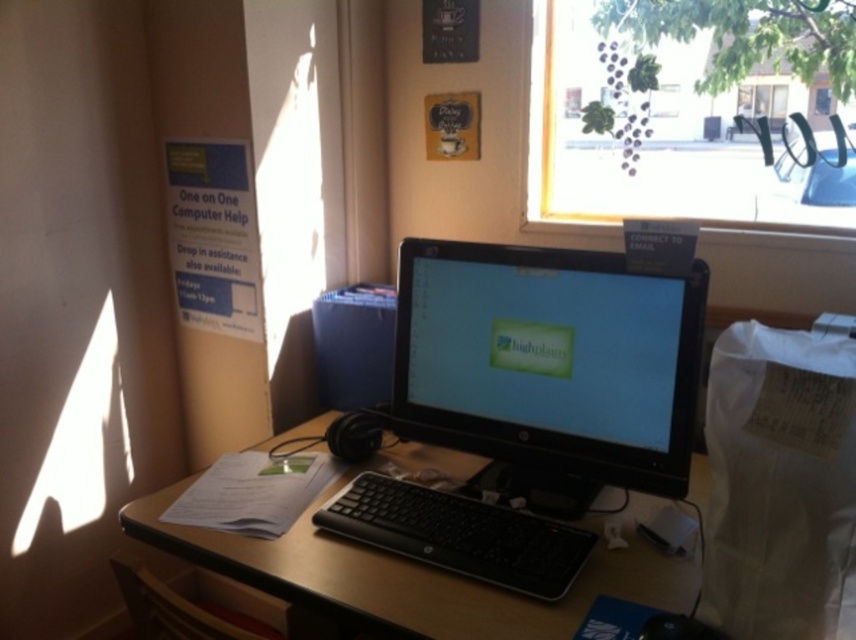
Question: Is black plastic computer desk at center to the left of black plastic keyboard at center from the viewer's perspective?

Choices:
 (A) yes
 (B) no

Answer: (A)

Question: Does black plastic monitor at center have a lesser width compared to satin black monitor at center?

Choices:
 (A) no
 (B) yes

Answer: (A)

Question: Which point is farther to the camera?

Choices:
 (A) black plastic monitor at center
 (B) black plastic keyboard at center
 (C) satin black monitor at center
 (D) transparent glass window at upper right

Answer: (D)

Question: Estimate the real-world distances between objects in this image. Which object is farther from the black plastic computer desk at center?

Choices:
 (A) satin black monitor at center
 (B) transparent glass window at upper right

Answer: (B)

Question: Can you confirm if transparent glass window at upper right is positioned to the left of black plastic computer desk at center?

Choices:
 (A) no
 (B) yes

Answer: (A)

Question: Estimate the real-world distances between objects in this image. Which object is farther from the satin black monitor at center?

Choices:
 (A) black plastic computer desk at center
 (B) black plastic keyboard at center
 (C) black plastic monitor at center

Answer: (A)